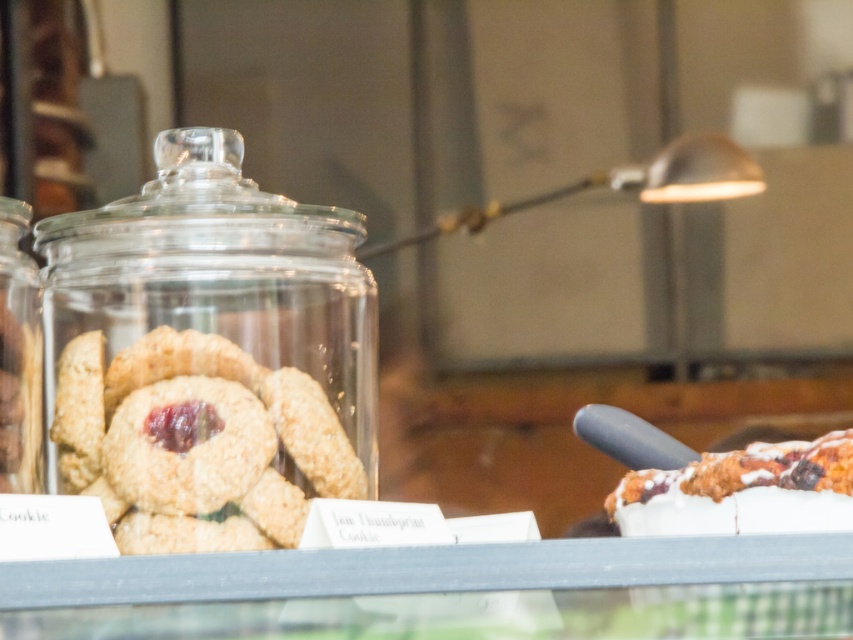
Question: Can you confirm if transparent glass jar at left is bigger than glazed sugar cookie at right?

Choices:
 (A) no
 (B) yes

Answer: (B)

Question: Is transparent glass jar at left in front of glazed sugar cookie at right?

Choices:
 (A) yes
 (B) no

Answer: (B)

Question: Can you confirm if transparent glass jar at left is positioned to the left of glazed sugar cookie at right?

Choices:
 (A) no
 (B) yes

Answer: (B)